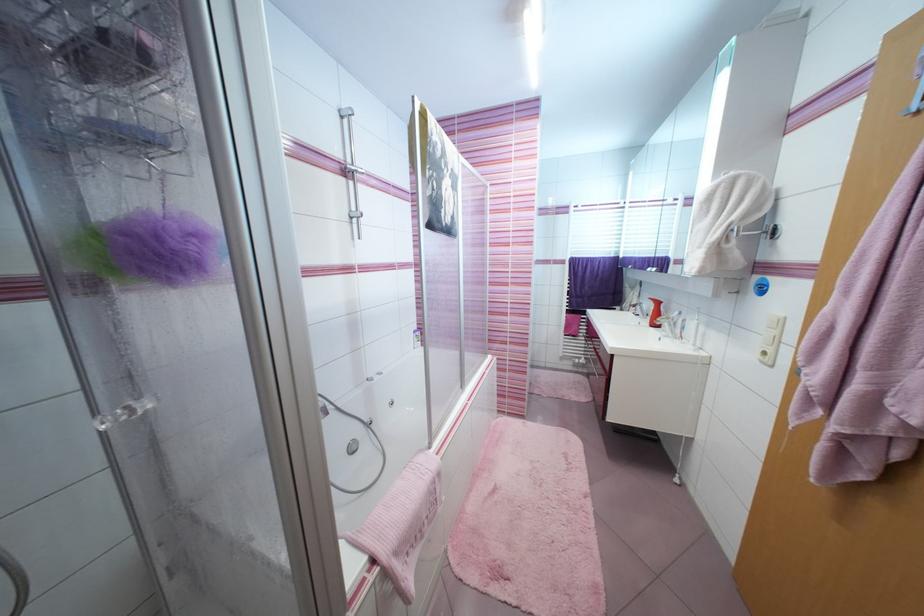
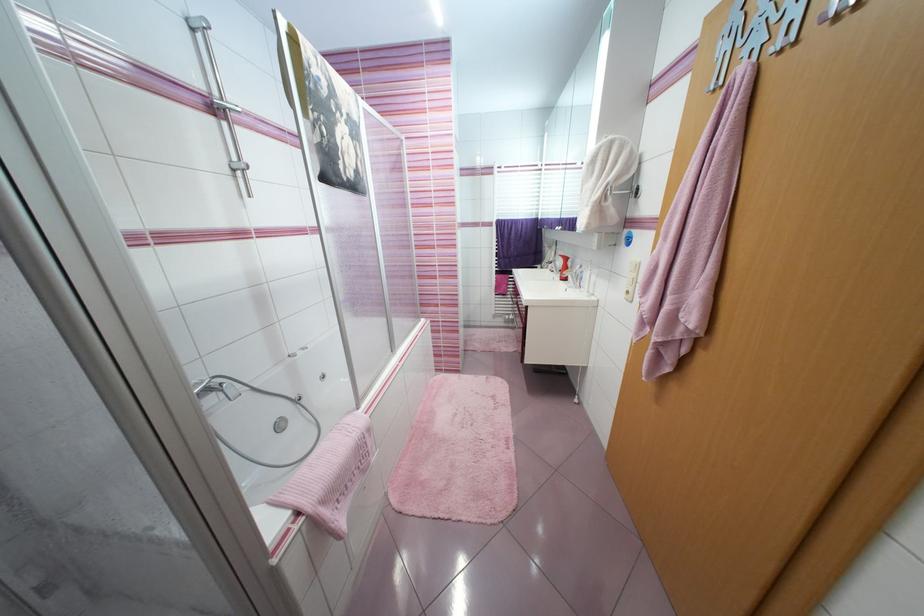
In the second image, find the point that corresponds to pixel 624 249 in the first image.

(543, 211)